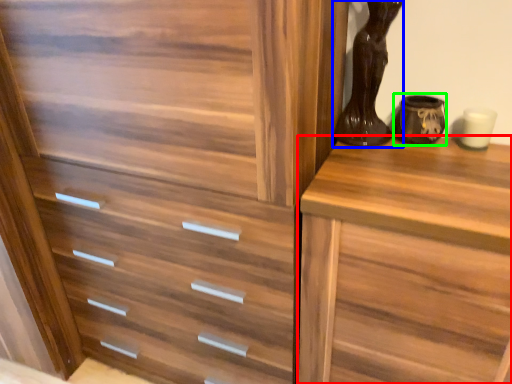
Question: Which is nearer to the chest of drawers (highlighted by a red box)? vase (highlighted by a blue box) or vase (highlighted by a green box).

Choices:
 (A) vase
 (B) vase

Answer: (A)